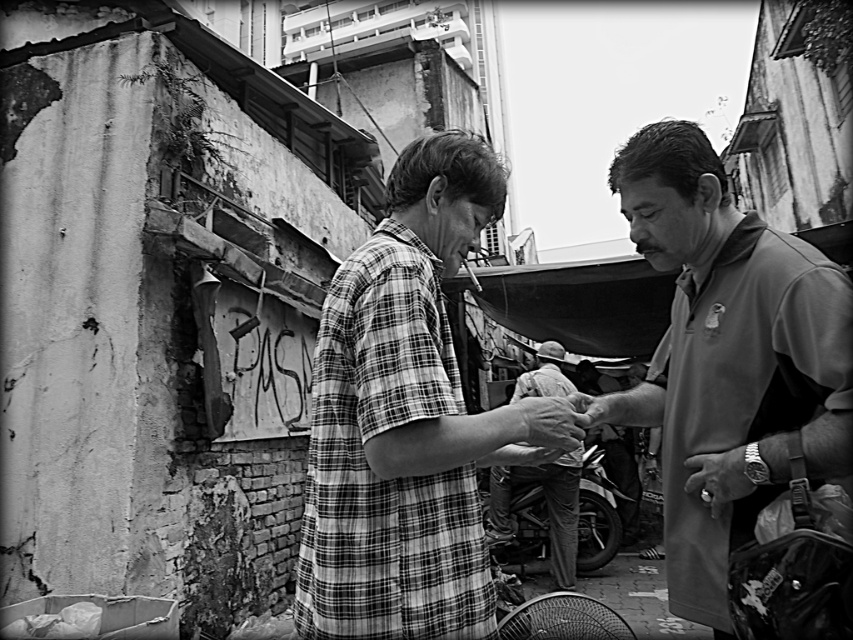
You are a photographer trying to capture a clear shot of both the plaid shirt at center and the smooth gray shirt at right. Since the fan is in the way, you decide to move around it. Which shirt should you prioritize focusing on first to ensure it stays in frame?

The plaid shirt at center is closer to the viewer than the smooth gray shirt at right, so you should prioritize focusing on the plaid shirt at center first to ensure it stays in frame as you move around the fan.

You are a photographer trying to capture both the plaid shirt at center and the smooth gray shirt at right in a single frame. Given their sizes, which shirt should you focus on to ensure both are clearly visible in the photo?

The plaid shirt at center is larger than the smooth gray shirt at right, so focusing on the plaid shirt at center will help ensure both are clearly visible in the photo.

You are a photographer trying to capture a clear shot of both the light gray fabric shirt at center and the smooth skin hand at center. Since the fan is in the way, you decide to move the camera slightly to the right. Which object will appear closer to the camera after moving?

The light gray fabric shirt at center will appear closer to the camera after moving because it is already further to the viewer than the smooth skin hand at center, so shifting the camera position might bring it into a more prominent focus.